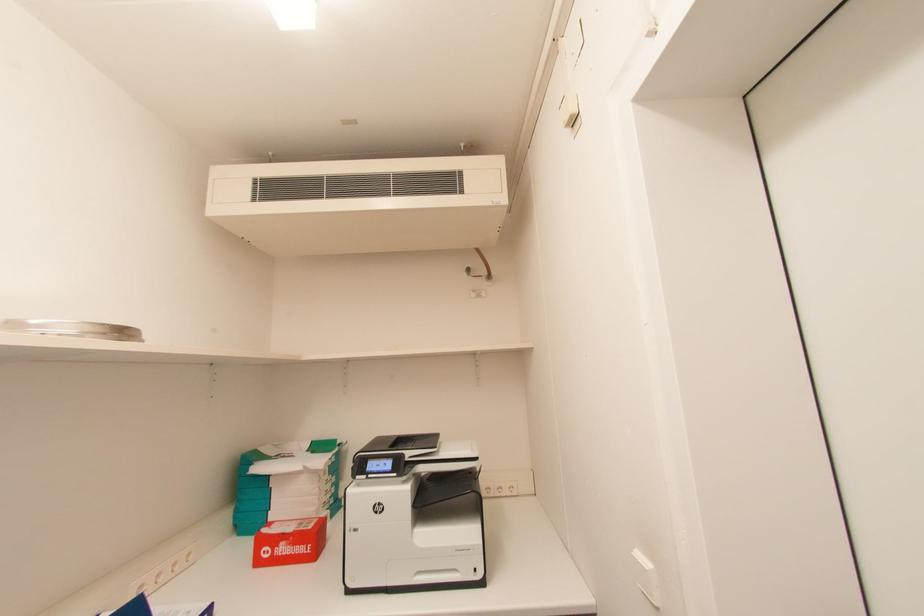
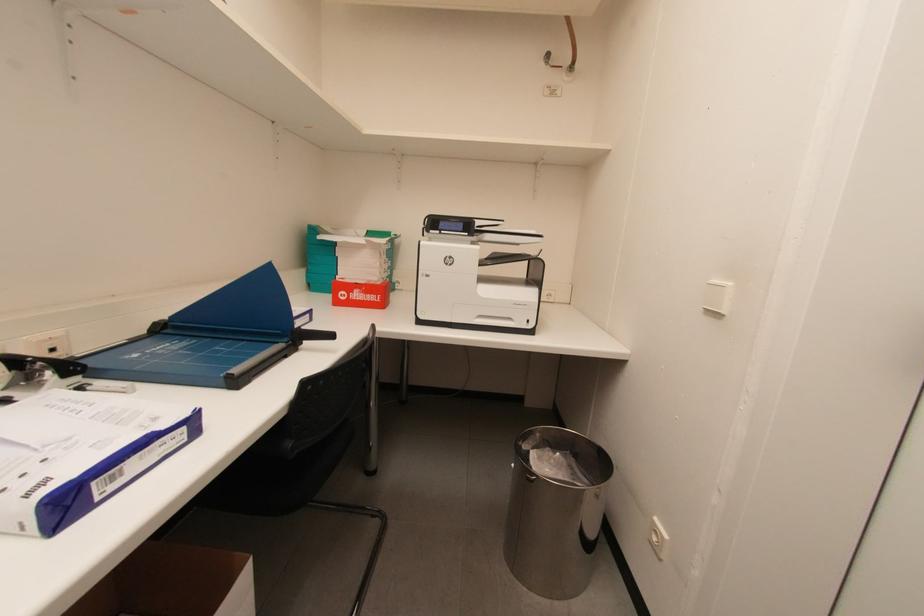
Question: The first image is from the beginning of the video and the second image is from the end. How did the camera likely rotate when shooting the video?

Choices:
 (A) Left
 (B) Right
 (C) Up
 (D) Down

Answer: (D)